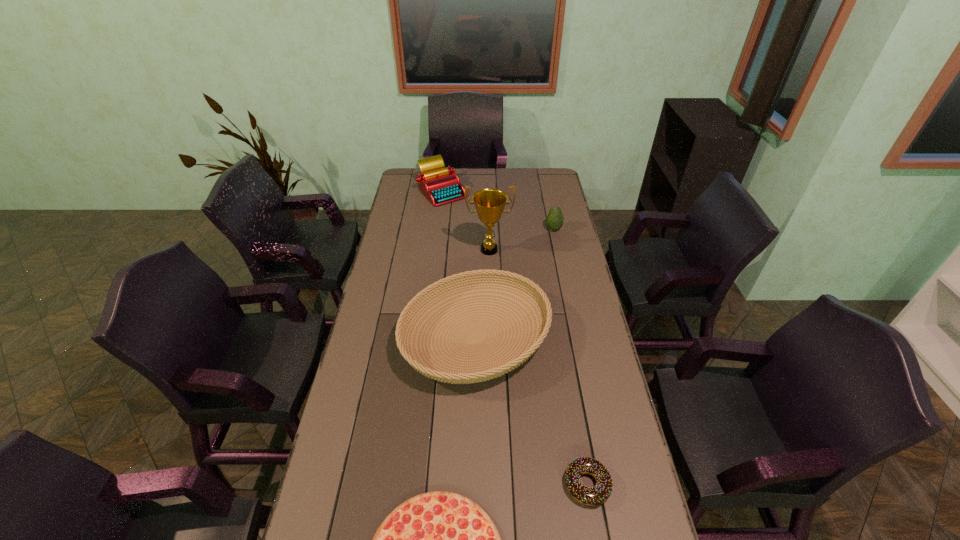
Identify the location of vacant space at the far left corner of the desktop. (403, 178).

Where is `vacant point located between the second shortest object and the fifth nearest object`? vacant point located between the second shortest object and the fifth nearest object is located at coordinates (570, 357).

Locate an element on the screen. This screenshot has height=540, width=960. free space between the farthest object and the fourth farthest object is located at coordinates (459, 265).

At what (x,y) coordinates should I click in order to perform the action: click on vacant area that lies between the avocado and the tallest object. Please return your answer as a coordinate pair (x, y). Looking at the image, I should click on (521, 239).

This screenshot has width=960, height=540. What are the coordinates of `free spot between the tallest object and the doughnut` in the screenshot? It's located at (539, 367).

Find the location of a particular element. The image size is (960, 540). free spot between the tallest object and the doughnut is located at coordinates (539, 367).

Find the location of a particular element. The height and width of the screenshot is (540, 960). object that is the third closest one to the third nearest object is located at coordinates (439, 539).

Locate an element on the screen. The image size is (960, 540). object that ranks as the closest to the typewriter is located at coordinates (489, 203).

Identify the location of free point that satisfies the following two spatial constraints: 1. on the typing side of the farthest object; 2. on the right side of the doughnut. The image size is (960, 540). (406, 484).

Where is `vacant space that satisfies the following two spatial constraints: 1. on the typing side of the basket; 2. on the left side of the farthest object`? vacant space that satisfies the following two spatial constraints: 1. on the typing side of the basket; 2. on the left side of the farthest object is located at coordinates (423, 338).